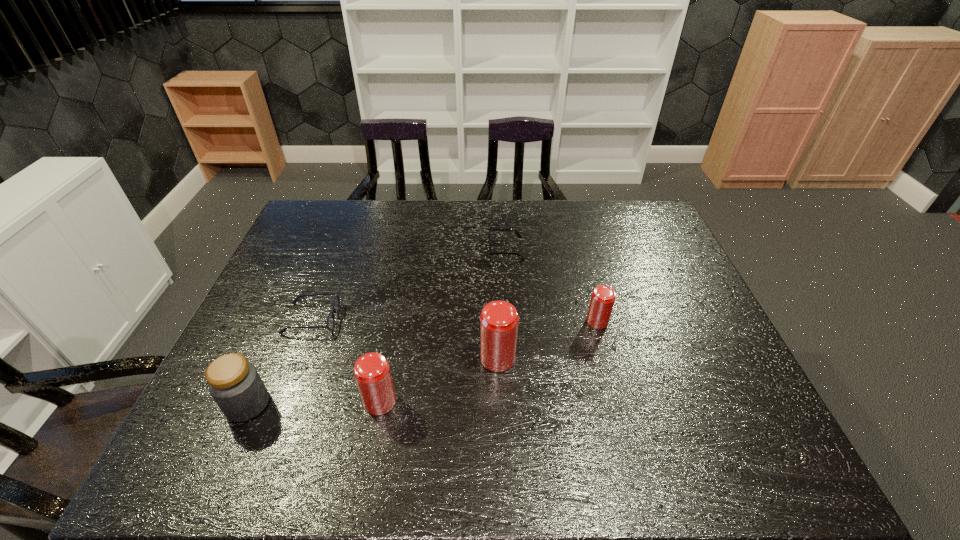
You are a GUI agent. You are given a task and a screenshot of the screen. Output one action in this format:
    pyautogui.click(x=<x>, y=<y>)
    Task: Click on the spectacles present at the left edge
    
    Given the screenshot: What is the action you would take?
    pyautogui.click(x=330, y=324)

The width and height of the screenshot is (960, 540). In order to click on jar at the left edge in this screenshot , I will do `click(234, 383)`.

You are a GUI agent. You are given a task and a screenshot of the screen. Output one action in this format:
    pyautogui.click(x=<x>, y=<y>)
    Task: Click on the object located in the near left corner section of the desktop
    This screenshot has width=960, height=540.
    Given the screenshot: What is the action you would take?
    pyautogui.click(x=234, y=383)

This screenshot has height=540, width=960. In the image, there is a desktop. In order to click on free space at the far edge in this screenshot , I will do `click(474, 201)`.

Where is `blank space at the near edge of the desktop`? The image size is (960, 540). blank space at the near edge of the desktop is located at coordinates (423, 425).

In the image, there is a desktop. At what (x,y) coordinates should I click in order to perform the action: click on vacant space at the left edge. Please return your answer as a coordinate pair (x, y). The height and width of the screenshot is (540, 960). Looking at the image, I should click on (264, 355).

Identify the location of vacant space at the right edge of the desktop. The height and width of the screenshot is (540, 960). (687, 324).

The width and height of the screenshot is (960, 540). Identify the location of blank area at the far left corner. (294, 232).

In the image, there is a desktop. Find the location of `free space at the near right corner`. free space at the near right corner is located at coordinates (698, 392).

In order to click on free point between the shortest beer can and the spectacles in this screenshot , I will do `click(454, 320)`.